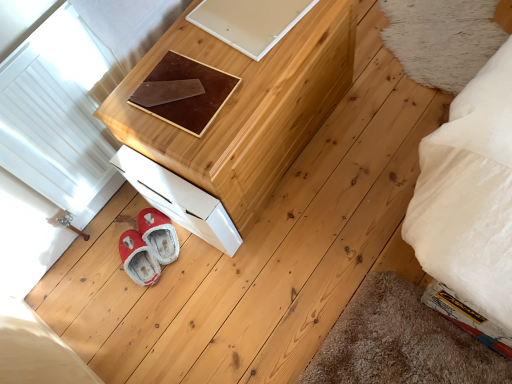
Image resolution: width=512 pixels, height=384 pixels. What are the coordinates of `unoccupied region to the right of white glossy drawer at lower left` in the screenshot? It's located at (272, 220).